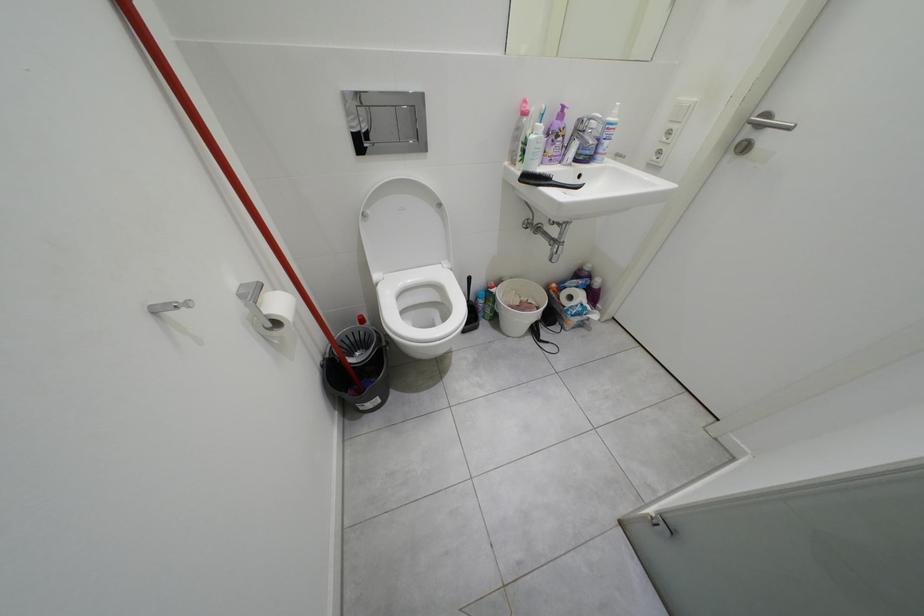
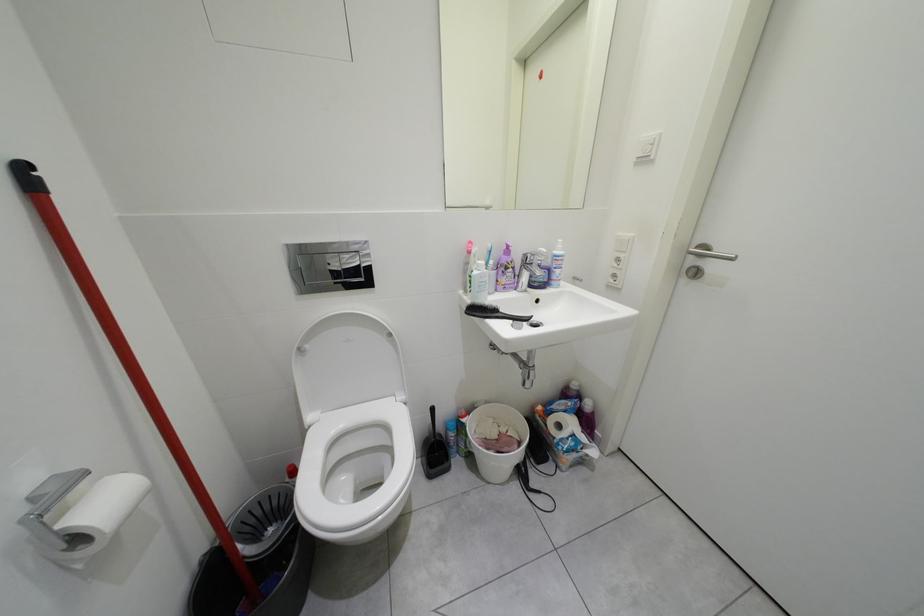
Question: How did the camera likely rotate?

Choices:
 (A) Left
 (B) Right
 (C) Up
 (D) Down

Answer: (C)